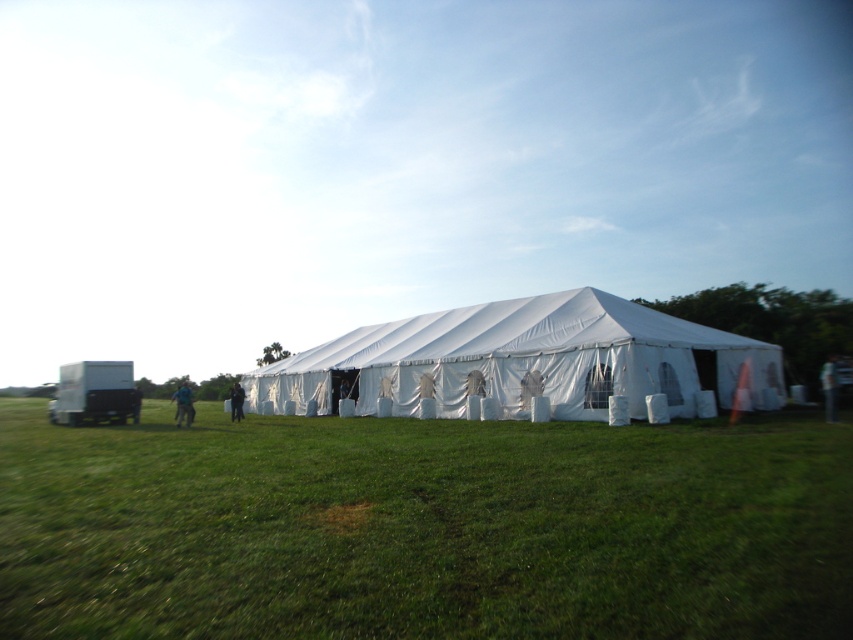
Question: Which is nearer to the green grass at lower center?

Choices:
 (A) green fabric person at right
 (B) white fabric tent at center
 (C) dark blue fabric at center
 (D) blue fabric person at lower left

Answer: (B)

Question: Can you confirm if green grass at lower center is positioned above green fabric person at right?

Choices:
 (A) yes
 (B) no

Answer: (B)

Question: Where is green grass at lower center located in relation to white fabric tent at center in the image?

Choices:
 (A) right
 (B) left

Answer: (B)

Question: Estimate the real-world distances between objects in this image. Which object is closer to the dark blue fabric at center?

Choices:
 (A) blue fabric person at lower left
 (B) green grass at lower center
 (C) white fabric tent at center
 (D) green fabric person at right

Answer: (C)

Question: Observing the image, what is the correct spatial positioning of white fabric tent at center in reference to blue fabric person at lower left?

Choices:
 (A) below
 (B) above

Answer: (B)

Question: Which point is closer to the camera?

Choices:
 (A) (177, 412)
 (B) (827, 387)
 (C) (589, 408)
 (D) (235, 403)

Answer: (C)